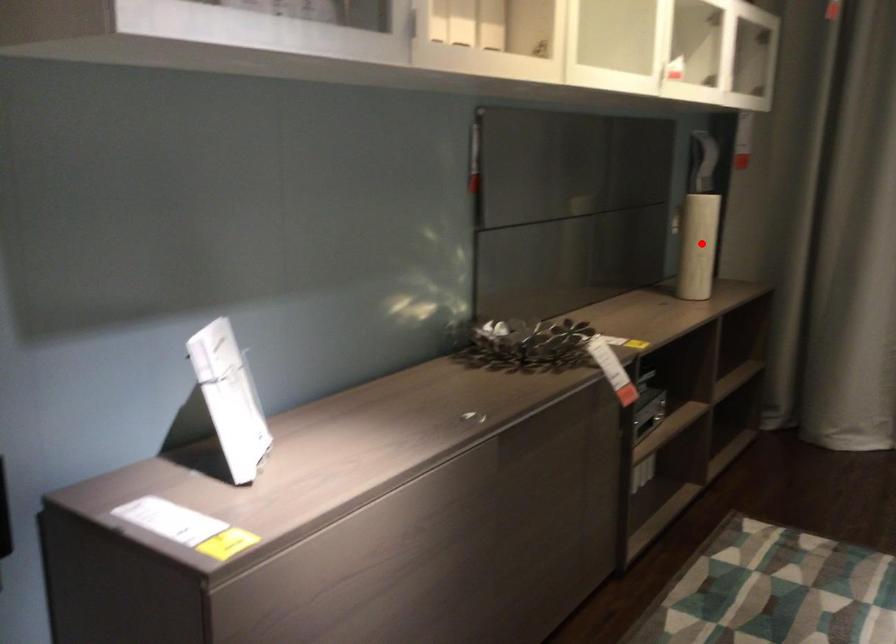
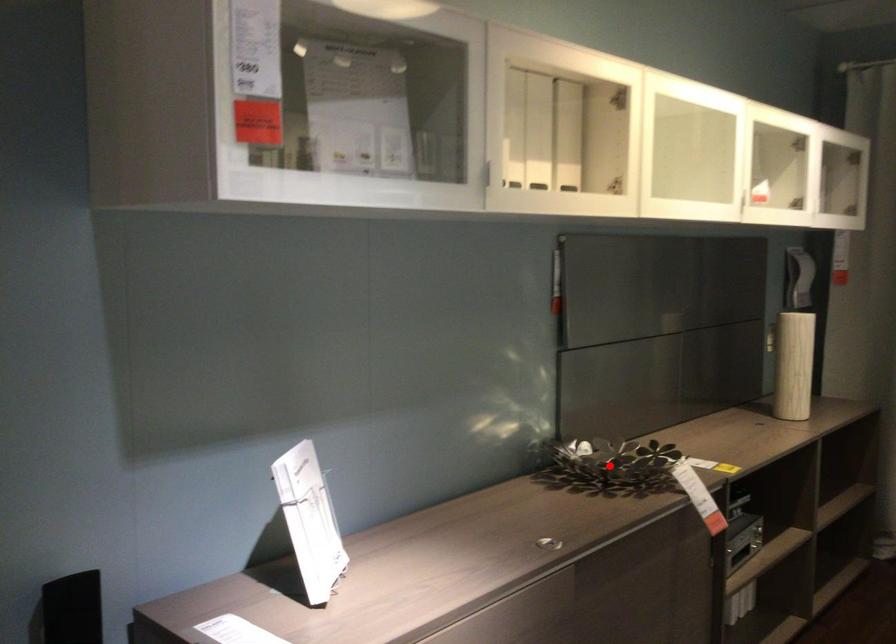
I am providing you with two images of the same scene from different viewpoints. A red point is marked on the first image and another point is marked on the second image. Is the red point in image1 aligned with the point shown in image2?

No